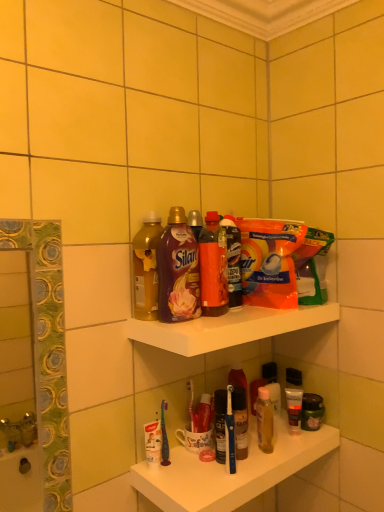
Image resolution: width=384 pixels, height=512 pixels. I want to click on vacant space in front of orange plastic bag at upper center, marked as the 1th cleaning product in a right-to-left arrangement, so click(x=247, y=314).